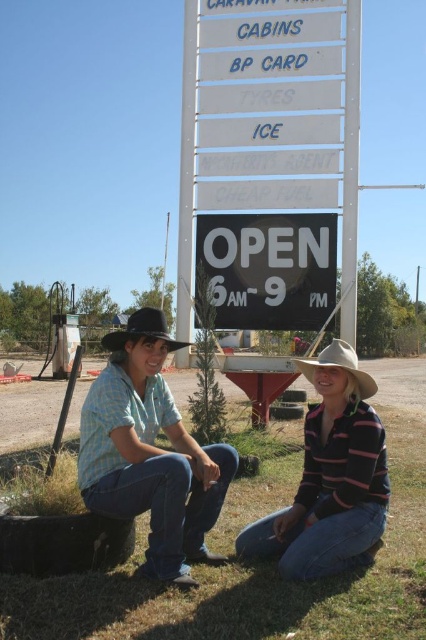
As a photographer, you want to ensure that both the striped cotton shirt at lower right and the light brown felt cowboy hat at lower right are in focus in your shot. Given that your camera has a depth of field that can cover 25 inches, will both items be in focus?

The striped cotton shirt at lower right and the light brown felt cowboy hat at lower right are 24.43 inches apart from each other. Since the distance between them is within the camera depth of field of 25 inches, both items will be in focus.

What are the coordinates of the black plastic sign at center?

The coordinates of the black plastic sign at center are at point (264, 269).